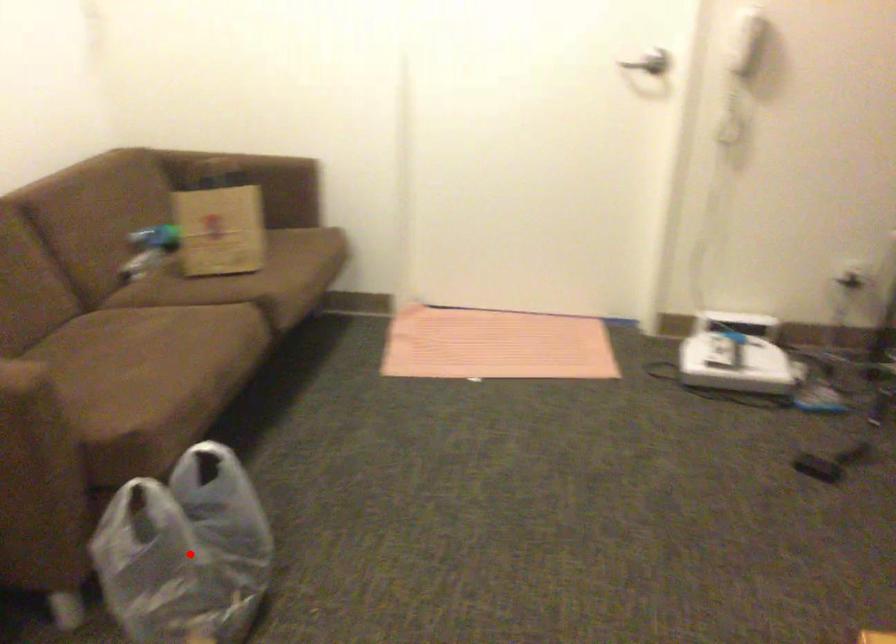
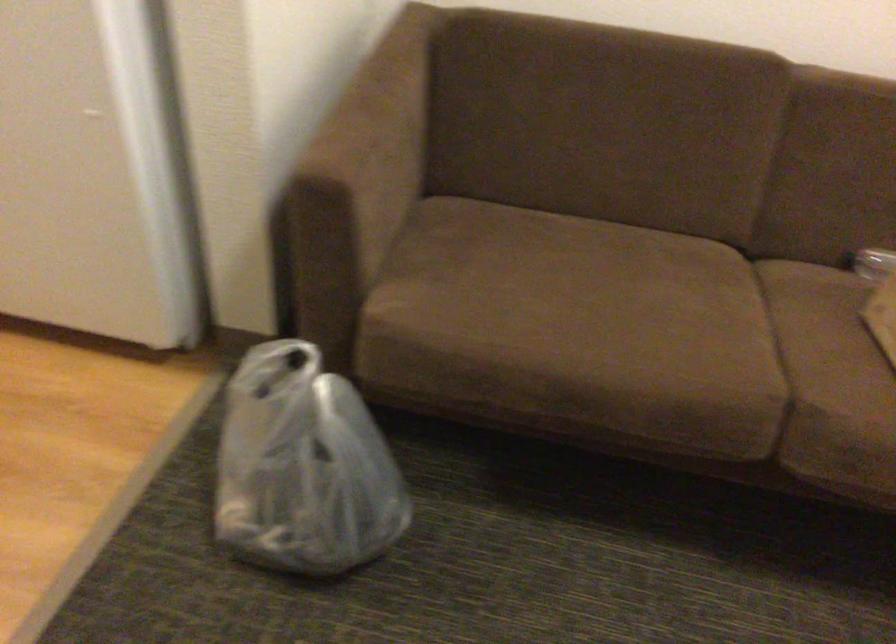
The point at the highlighted location is marked in the first image. Where is the corresponding point in the second image?

(304, 467)